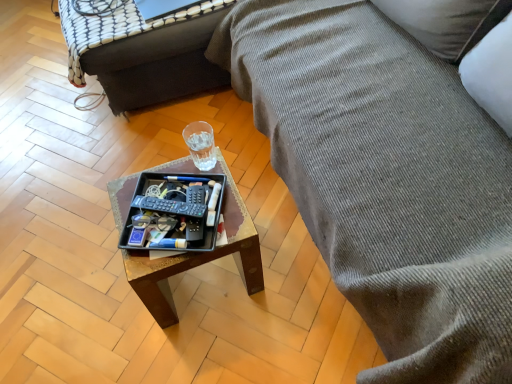
This screenshot has height=384, width=512. Describe the element at coordinates (201, 148) in the screenshot. I see `clear glass cup at center` at that location.

Locate an element on the screen. wooden tray at center is located at coordinates (198, 258).

Locate an element on the screen. The width and height of the screenshot is (512, 384). beverage above the wooden tray at center (from a real-world perspective) is located at coordinates (201, 148).

Which object is closer to the camera taking this photo, wooden tray at center or clear glass cup at center?

wooden tray at center.

Considering the positions of point (181, 168) and point (189, 131), is point (181, 168) closer or farther from the camera than point (189, 131)?

Point (181, 168) is closer to the camera than point (189, 131).

Is clear glass cup at center looking in the opposite direction of black plastic tray at center?

clear glass cup at center does not have its back to black plastic tray at center.

Considering the points (208, 168) and (184, 225), which point is in front, point (208, 168) or point (184, 225)?

The point (184, 225) is closer.

Would you say clear glass cup at center is inside or outside black plastic tray at center?

clear glass cup at center lies outside black plastic tray at center.

Is clear glass cup at center closer to the viewer compared to black plastic tray at center?

No, clear glass cup at center is behind black plastic tray at center.

How far apart are wooden tray at center and clear glass cup at center?

They are 23.35 inches apart.

Is wooden tray at center wider or thinner than clear glass cup at center?

In the image, wooden tray at center appears to be wider than clear glass cup at center.

From a real-world perspective, relative to clear glass cup at center, is wooden tray at center vertically above or below?

wooden tray at center is situated lower than clear glass cup at center in the real world.

In order to click on beverage in front of the wooden tray at center in this screenshot , I will do `click(201, 148)`.

In terms of height, does clear glass cup at center look taller or shorter compared to wooden tray at center?

clear glass cup at center is shorter than wooden tray at center.

Which object is further away from the camera taking this photo, clear glass cup at center or wooden tray at center?

wooden tray at center is behind.

Measure the distance from clear glass cup at center to wooden tray at center.

A distance of 23.35 inches exists between clear glass cup at center and wooden tray at center.

Find the location of a particular element. beverage located in front of the wooden tray at center is located at coordinates (201, 148).

Who is smaller, black plastic tray at center or wooden tray at center?

Smaller between the two is black plastic tray at center.

Is black plastic tray at center shorter than wooden tray at center?

Yes, black plastic tray at center is shorter than wooden tray at center.

Is black plastic tray at center oriented towards wooden tray at center?

No, black plastic tray at center does not turn towards wooden tray at center.

In the scene shown: Choose the correct answer: Is black plastic tray at center inside wooden tray at center or outside it?

black plastic tray at center is located beyond the bounds of wooden tray at center.

From the image's perspective, who appears lower, clear glass cup at center or wooden tray at center?

From the image's view, wooden tray at center is below.

Is clear glass cup at center positioned with its back to wooden tray at center?

No, wooden tray at center is not at the back of clear glass cup at center.

Is clear glass cup at center far away from wooden tray at center?

No.

Is clear glass cup at center positioned beyond the bounds of wooden tray at center?

Yes.

Are wooden tray at center and wooden tray at center beside each other?

No, wooden tray at center is not beside wooden tray at center.

What's the angular difference between wooden tray at center and wooden tray at center's facing directions?

They differ by 89.8 degrees in their facing directions.

Is wooden tray at center smaller than wooden tray at center?

Correct, wooden tray at center occupies less space than wooden tray at center.

From a real-world perspective, is wooden tray at center positioned above or below wooden tray at center?

wooden tray at center is below wooden tray at center.

At what (x,y) coordinates should I click in order to perform the action: click on coffee table on the left of clear glass cup at center. Please return your answer as a coordinate pair (x, y). Looking at the image, I should click on (198, 258).

Locate an element on the screen. The width and height of the screenshot is (512, 384). tray below the clear glass cup at center (from the image's perspective) is located at coordinates pos(172,213).

From the image, which object appears to be farther from black plastic tray at center, wooden tray at center or wooden tray at center?

Based on the image, wooden tray at center appears to be further to black plastic tray at center.

From the image, which object appears to be farther from black plastic tray at center, wooden tray at center or textured gray fabric couch at right?

Based on the image, wooden tray at center appears to be further to black plastic tray at center.

When comparing their distances from textured gray fabric couch at right, does clear glass cup at center or wooden tray at center seem further?

Among the two, wooden tray at center is located further to textured gray fabric couch at right.

Considering their positions, is clear glass cup at center positioned further to black plastic tray at center than textured gray fabric couch at right?

textured gray fabric couch at right lies further to black plastic tray at center than the other object.

Considering their positions, is wooden tray at center positioned closer to wooden tray at center than clear glass cup at center?

The object closer to wooden tray at center is clear glass cup at center.

When comparing their distances from clear glass cup at center, does black plastic tray at center or wooden tray at center seem further?

Among the two, wooden tray at center is located further to clear glass cup at center.

Estimate the real-world distances between objects in this image. Which object is further from clear glass cup at center, black plastic tray at center or textured gray fabric couch at right?

Among the two, textured gray fabric couch at right is located further to clear glass cup at center.

Estimate the real-world distances between objects in this image. Which object is further from black plastic tray at center, wooden tray at center or wooden tray at center?

wooden tray at center lies further to black plastic tray at center than the other object.

Find the location of a particular element. The height and width of the screenshot is (384, 512). beverage between wooden tray at center and black plastic tray at center in the vertical direction is located at coordinates (201, 148).

Find the location of a particular element. tray between wooden tray at center and wooden tray at center vertically is located at coordinates (172, 213).

This screenshot has height=384, width=512. I want to click on beverage between textured gray fabric couch at right and wooden tray at center in the front-back direction, so click(x=201, y=148).

This screenshot has width=512, height=384. Find the location of `tray located between textured gray fabric couch at right and wooden tray at center in the depth direction`. tray located between textured gray fabric couch at right and wooden tray at center in the depth direction is located at coordinates (172, 213).